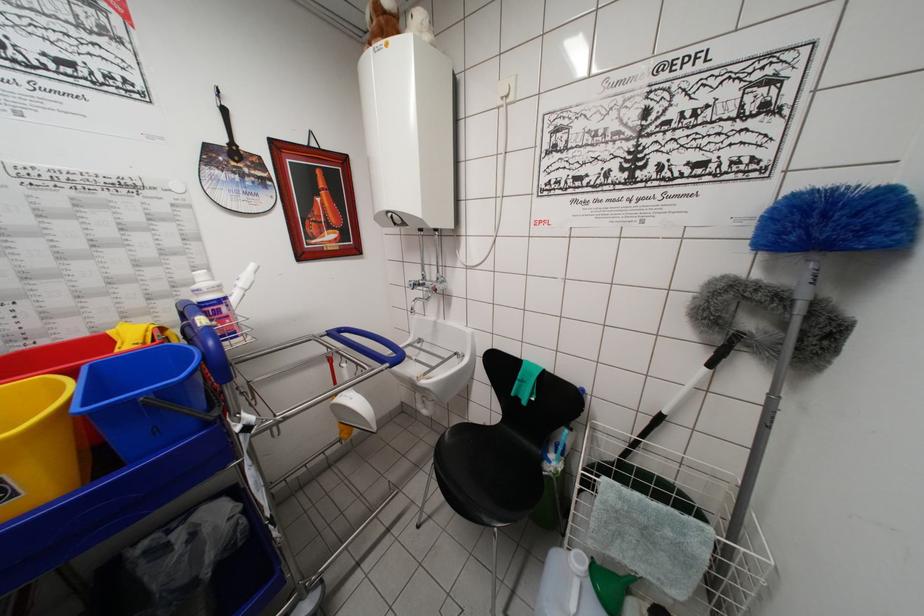
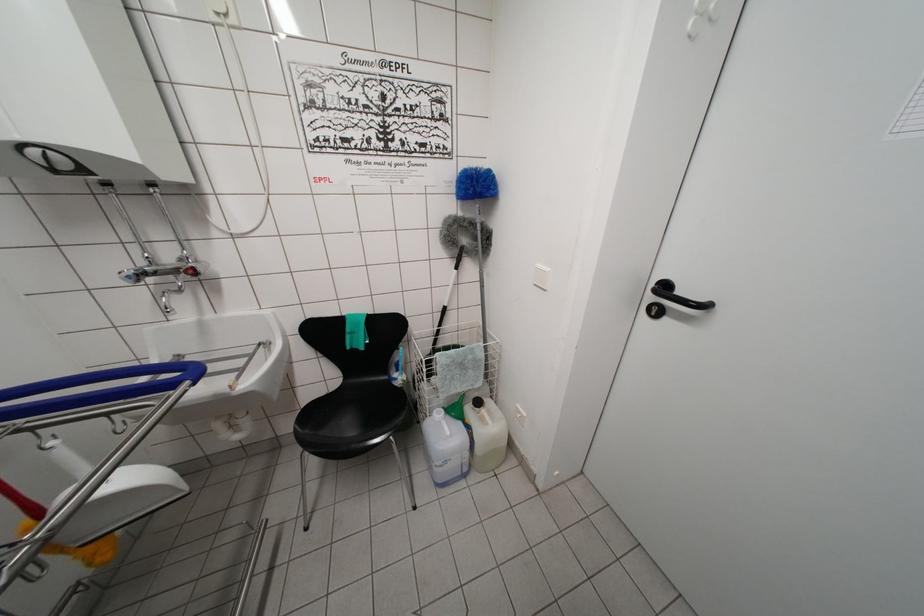
Where in the second image is the point corresponding to point (495, 428) from the first image?

(335, 395)